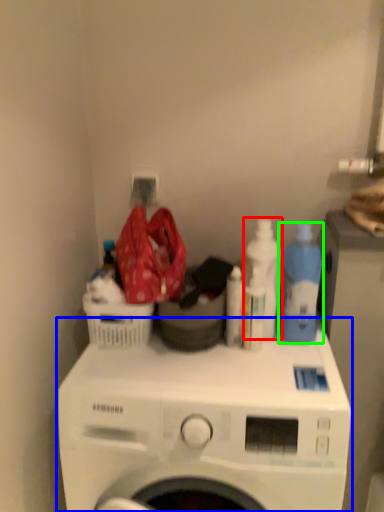
Question: Which object is the closest to the cleaning product (highlighted by a red box)? Choose among these: washing machine (highlighted by a blue box) or cleaning product (highlighted by a green box).

Choices:
 (A) washing machine
 (B) cleaning product

Answer: (B)